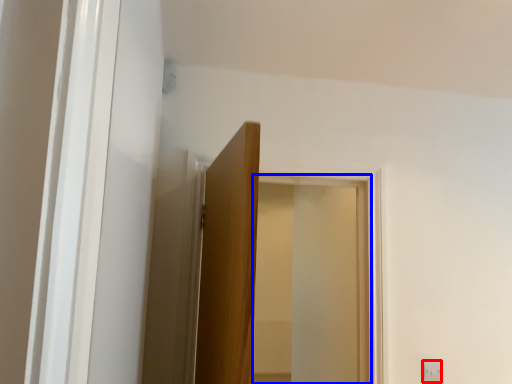
Question: Which object appears farthest to the camera in this image, light switch (highlighted by a red box) or window (highlighted by a blue box)?

Choices:
 (A) light switch
 (B) window

Answer: (A)